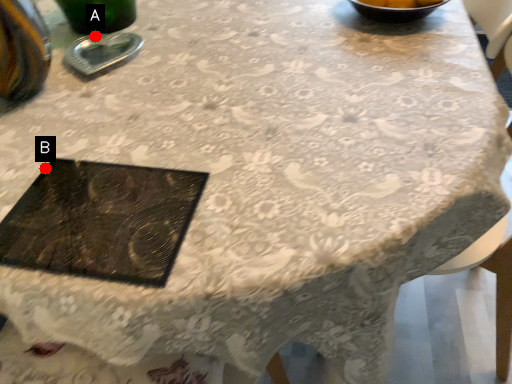
Question: Two points are circled on the image, labeled by A and B beside each circle. Among these points, which one is nearest to the camera?

Choices:
 (A) A is closer
 (B) B is closer

Answer: (B)